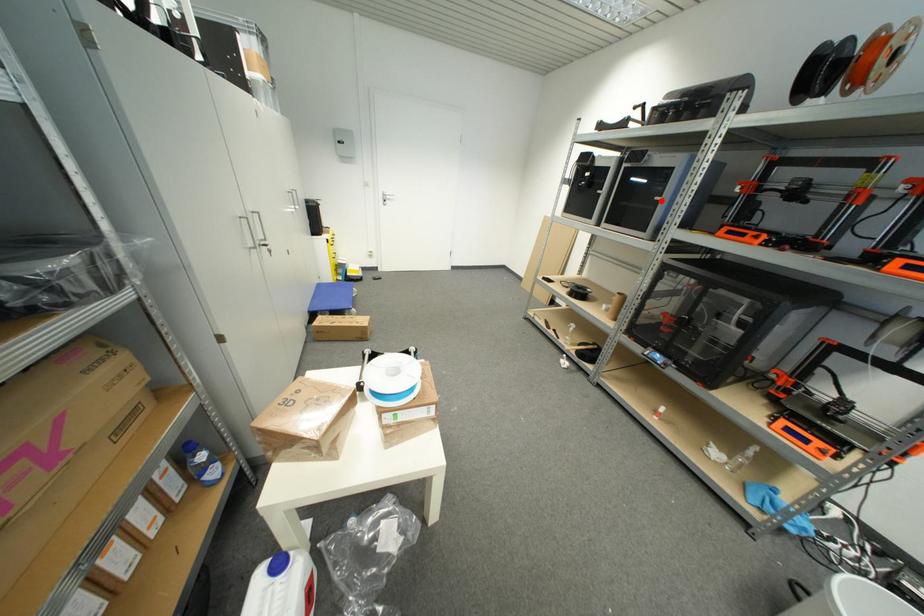
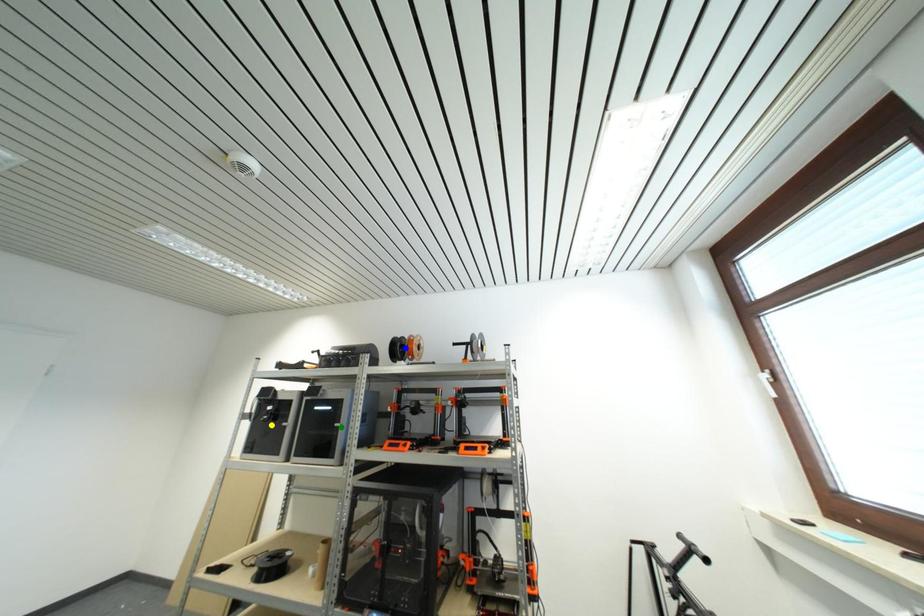
Question: I am providing you with two images of the same scene from different viewpoints. A red point is marked on the first image. You are given multiple points on the second image. Which point in image 2 represents the same 3d spot as the red point in image 1?

Choices:
 (A) yellow point
 (B) blue point
 (C) green point

Answer: (C)